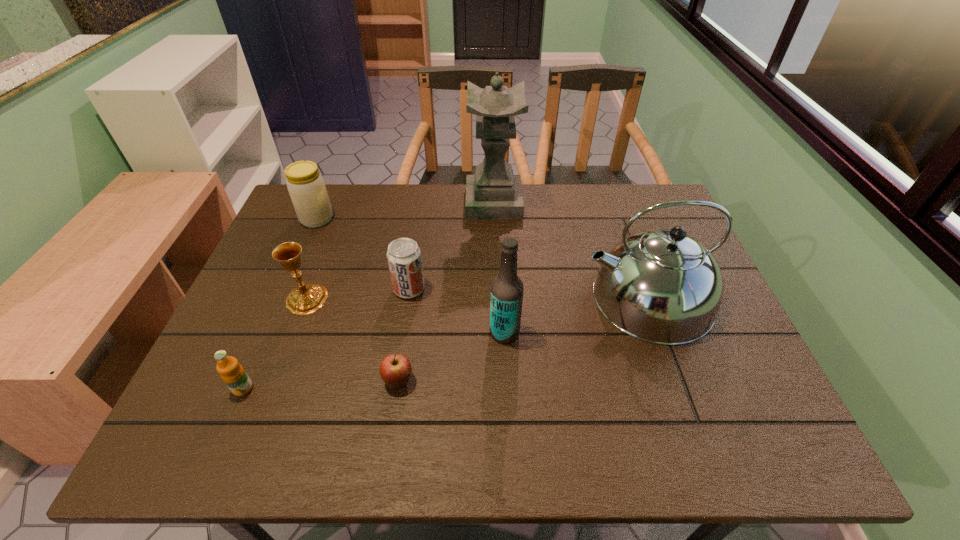
The image size is (960, 540). What are the coordinates of `vacant space positioned 0.050m at the front opening of the sculpture` in the screenshot? It's located at (450, 203).

You are a GUI agent. You are given a task and a screenshot of the screen. Output one action in this format:
    pyautogui.click(x=<x>, y=<y>)
    Task: Click on the vacant area located from the spout of the rightmost object
    
    Given the screenshot: What is the action you would take?
    pyautogui.click(x=444, y=298)

Where is `vacant space situated 0.060m from the spout of the rightmost object`? The height and width of the screenshot is (540, 960). vacant space situated 0.060m from the spout of the rightmost object is located at coordinates (558, 298).

Image resolution: width=960 pixels, height=540 pixels. What are the coordinates of `free space located from the spout of the rightmost object` in the screenshot? It's located at (x=440, y=298).

Locate an element on the screen. Image resolution: width=960 pixels, height=540 pixels. free space located 0.330m on the label of the beer bottle is located at coordinates (349, 333).

Where is `free location located 0.140m on the label of the beer bottle`? The width and height of the screenshot is (960, 540). free location located 0.140m on the label of the beer bottle is located at coordinates 430,333.

Where is `vacant area located on the label of the beer bottle`? This screenshot has height=540, width=960. vacant area located on the label of the beer bottle is located at coordinates (468, 333).

At what (x,y) coordinates should I click in order to perform the action: click on free location located 0.370m on the right of the jar. Please return your answer as a coordinate pair (x, y). The image size is (960, 540). Looking at the image, I should click on (454, 219).

This screenshot has width=960, height=540. In order to click on free region located 0.270m on the front of the chalice in this screenshot , I will do [262, 418].

Find the location of a particular element. free space located 0.180m on the front of the soda can is located at coordinates (398, 361).